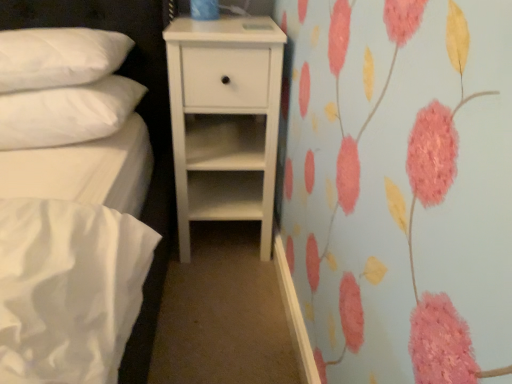
Question: Can you confirm if white quilted pillow at upper left, which is the first pillow from top to bottom, is smaller than white soft pillow at upper left, marked as the 1th pillow in a bottom-to-top arrangement?

Choices:
 (A) yes
 (B) no

Answer: (B)

Question: Is white quilted pillow at upper left, which is the first pillow from top to bottom, facing towards white soft pillow at upper left, marked as the 1th pillow in a bottom-to-top arrangement?

Choices:
 (A) yes
 (B) no

Answer: (B)

Question: Can you confirm if white quilted pillow at upper left, the 2th pillow positioned from the bottom, is thinner than white soft pillow at upper left, marked as the 1th pillow in a bottom-to-top arrangement?

Choices:
 (A) no
 (B) yes

Answer: (B)

Question: Considering the relative positions of white quilted pillow at upper left, the 2th pillow positioned from the bottom, and white soft pillow at upper left, marked as the 1th pillow in a bottom-to-top arrangement, in the image provided, is white quilted pillow at upper left, the 2th pillow positioned from the bottom, to the right of white soft pillow at upper left, marked as the 1th pillow in a bottom-to-top arrangement, from the viewer's perspective?

Choices:
 (A) no
 (B) yes

Answer: (A)

Question: Does white quilted pillow at upper left, which is the first pillow from top to bottom, have a lesser height compared to white soft pillow at upper left, marked as the 1th pillow in a bottom-to-top arrangement?

Choices:
 (A) yes
 (B) no

Answer: (B)

Question: Considering their positions, is white soft pillow at upper left, marked as the 1th pillow in a bottom-to-top arrangement, located in front of or behind white matte chest of drawers at center?

Choices:
 (A) front
 (B) behind

Answer: (A)

Question: From the image's perspective, is white soft pillow at upper left, arranged as the second pillow when viewed from the top, located above or below white matte chest of drawers at center?

Choices:
 (A) below
 (B) above

Answer: (B)

Question: In the image, is white soft pillow at upper left, arranged as the second pillow when viewed from the top, on the left side or the right side of white matte chest of drawers at center?

Choices:
 (A) left
 (B) right

Answer: (A)

Question: Does point (108, 125) appear closer or farther from the camera than point (262, 31)?

Choices:
 (A) closer
 (B) farther

Answer: (A)

Question: Is white matte chest of drawers at center spatially inside white soft pillow at upper left, marked as the 1th pillow in a bottom-to-top arrangement, or outside of it?

Choices:
 (A) outside
 (B) inside

Answer: (A)

Question: Based on their sizes in the image, would you say white matte chest of drawers at center is bigger or smaller than white soft pillow at upper left, marked as the 1th pillow in a bottom-to-top arrangement?

Choices:
 (A) big
 (B) small

Answer: (A)

Question: From the image's perspective, is white matte chest of drawers at center positioned above or below white soft pillow at upper left, marked as the 1th pillow in a bottom-to-top arrangement?

Choices:
 (A) above
 (B) below

Answer: (B)

Question: Is point (199, 99) closer or farther from the camera than point (98, 96)?

Choices:
 (A) farther
 (B) closer

Answer: (A)

Question: In terms of height, does white quilted pillow at upper left, which is the first pillow from top to bottom, look taller or shorter compared to white matte chest of drawers at center?

Choices:
 (A) tall
 (B) short

Answer: (B)

Question: Is white quilted pillow at upper left, which is the first pillow from top to bottom, inside or outside of white matte chest of drawers at center?

Choices:
 (A) inside
 (B) outside

Answer: (B)